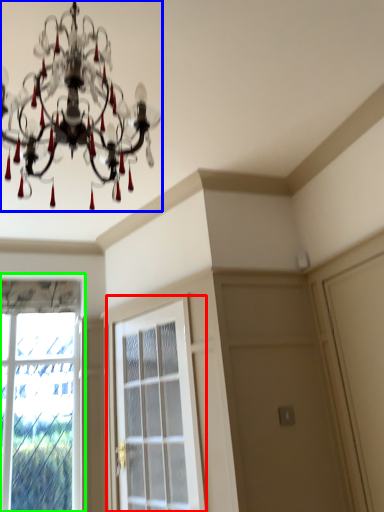
Question: Estimate the real-world distances between objects in this image. Which object is closer to screen door (highlighted by a red box), lamp (highlighted by a blue box) or window (highlighted by a green box)?

Choices:
 (A) lamp
 (B) window

Answer: (B)